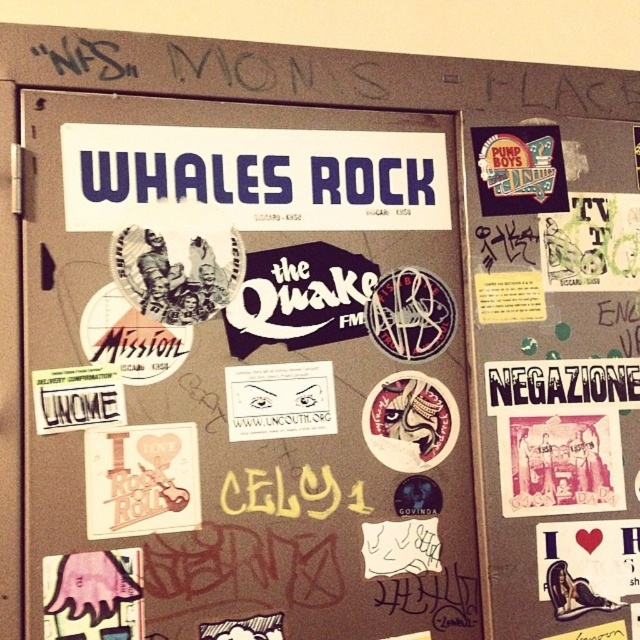
Who is more distant from viewer, (532,520) or (490,369)?

The point (490,369) is more distant.

Which is above, matte black sticker at upper right or white paper at upper center?

matte black sticker at upper right

Who is more forward, (515, 602) or (586, 371)?

Point (515, 602)

The height and width of the screenshot is (640, 640). I want to click on matte black sticker at upper right, so click(x=556, y=372).

Does white paper at center have a larger size compared to white paper at upper center?

Yes.

Between white paper at center and white paper at upper center, which one has less height?

white paper at upper center is shorter.

Locate an element on the screen. This screenshot has height=640, width=640. white paper at center is located at coordinates (244, 378).

In order to click on white paper at center in this screenshot , I will do `click(244, 378)`.

Is point (339, 458) farther from camera compared to point (621, 268)?

No, (339, 458) is in front of (621, 268).

Does point (49, 452) come behind point (572, 490)?

No, (49, 452) is closer to viewer.

This screenshot has width=640, height=640. I want to click on white paper at center, so click(x=244, y=378).